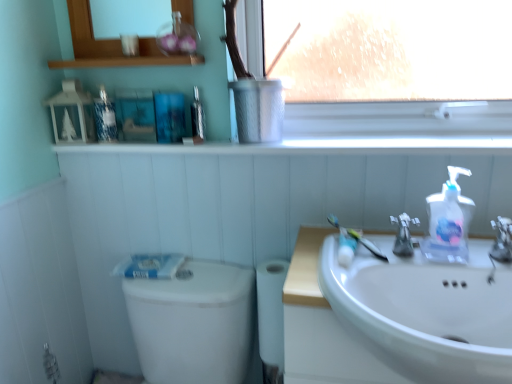
Question: From the image's perspective, would you say metallic silver window sill at upper center, the 1th window sill positioned from the top, is positioned over metallic silver mouthwash at upper center, positioned as the first mouthwash in right-to-left order?

Choices:
 (A) yes
 (B) no

Answer: (A)

Question: Does metallic silver window sill at upper center, the 1th window sill positioned from the top, have a lesser width compared to metallic silver mouthwash at upper center, the second mouthwash from the left?

Choices:
 (A) no
 (B) yes

Answer: (A)

Question: Is metallic silver window sill at upper center, the 1th window sill positioned from the top, turned away from metallic silver mouthwash at upper center, positioned as the first mouthwash in right-to-left order?

Choices:
 (A) no
 (B) yes

Answer: (A)

Question: Is metallic silver window sill at upper center, the 1th window sill positioned from the top, positioned behind metallic silver mouthwash at upper center, positioned as the first mouthwash in right-to-left order?

Choices:
 (A) yes
 (B) no

Answer: (B)

Question: Is metallic silver window sill at upper center, the 1th window sill positioned from the top, directly adjacent to metallic silver mouthwash at upper center, positioned as the first mouthwash in right-to-left order?

Choices:
 (A) no
 (B) yes

Answer: (A)

Question: Looking at the image, does white matte toilet paper at lower center seem bigger or smaller compared to metallic silver mouthwash at upper center, positioned as the first mouthwash in right-to-left order?

Choices:
 (A) big
 (B) small

Answer: (A)

Question: From the image's perspective, is white matte toilet paper at lower center positioned above or below metallic silver mouthwash at upper center, the second mouthwash from the left?

Choices:
 (A) above
 (B) below

Answer: (B)

Question: Considering the positions of white matte toilet paper at lower center and metallic silver mouthwash at upper center, the second mouthwash from the left, in the image, is white matte toilet paper at lower center wider or thinner than metallic silver mouthwash at upper center, the second mouthwash from the left,?

Choices:
 (A) thin
 (B) wide

Answer: (B)

Question: From a real-world perspective, is white matte toilet paper at lower center physically located above or below metallic silver mouthwash at upper center, positioned as the first mouthwash in right-to-left order?

Choices:
 (A) above
 (B) below

Answer: (B)

Question: Is clear glass medicine cabinet at upper center to the left or to the right of white glossy toilet bowl at lower left in the image?

Choices:
 (A) left
 (B) right

Answer: (A)

Question: Is clear glass medicine cabinet at upper center wider or thinner than white glossy toilet bowl at lower left?

Choices:
 (A) thin
 (B) wide

Answer: (A)

Question: In terms of height, does clear glass medicine cabinet at upper center look taller or shorter compared to white glossy toilet bowl at lower left?

Choices:
 (A) short
 (B) tall

Answer: (A)

Question: From the image's perspective, is clear glass medicine cabinet at upper center above or below white glossy toilet bowl at lower left?

Choices:
 (A) above
 (B) below

Answer: (A)

Question: Considering the relative positions of translucent plastic toothbrush at sink and white glossy window sill at upper center, which is the second window sill from top to bottom, in the image provided, is translucent plastic toothbrush at sink to the left or to the right of white glossy window sill at upper center, which is the second window sill from top to bottom,?

Choices:
 (A) right
 (B) left

Answer: (A)

Question: Considering the positions of translucent plastic toothbrush at sink and white glossy window sill at upper center, which is the first window sill in bottom-to-top order, in the image, is translucent plastic toothbrush at sink wider or thinner than white glossy window sill at upper center, which is the first window sill in bottom-to-top order,?

Choices:
 (A) thin
 (B) wide

Answer: (A)